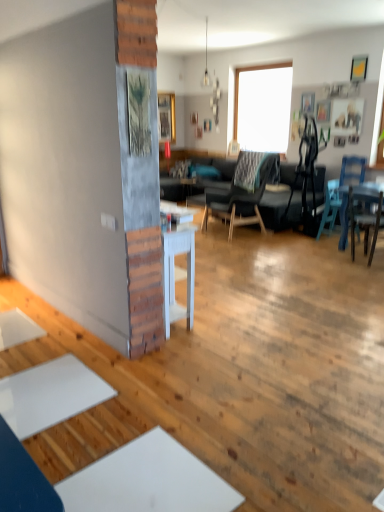
Question: In which direction should I rotate to look at wooden textured picture frame at center, marked as the first picture frame in a bottom-to-top arrangement?

Choices:
 (A) left
 (B) right

Answer: (A)

Question: Can you confirm if dark gray fabric chair at center, which is counted as the third chair, starting from the right, is bigger than blue plastic chair at right, the second chair from the right?

Choices:
 (A) no
 (B) yes

Answer: (B)

Question: From a real-world perspective, is dark gray fabric chair at center, which is counted as the third chair, starting from the right, physically above blue plastic chair at right, the second chair from the right?

Choices:
 (A) yes
 (B) no

Answer: (A)

Question: Does dark gray fabric chair at center, marked as the first chair in a left-to-right arrangement, have a greater height compared to blue plastic chair at right, the 2th chair from the left?

Choices:
 (A) yes
 (B) no

Answer: (A)

Question: Is dark gray fabric chair at center, which is counted as the third chair, starting from the right, not near blue plastic chair at right, the 2th chair from the left?

Choices:
 (A) yes
 (B) no

Answer: (A)

Question: Considering the relative sizes of dark gray fabric chair at center, marked as the first chair in a left-to-right arrangement, and blue plastic chair at right, the 2th chair from the left, in the image provided, is dark gray fabric chair at center, marked as the first chair in a left-to-right arrangement, thinner than blue plastic chair at right, the 2th chair from the left,?

Choices:
 (A) no
 (B) yes

Answer: (A)

Question: Does dark gray fabric chair at center, which is counted as the third chair, starting from the right, come in front of blue plastic chair at right, the 2th chair from the left?

Choices:
 (A) no
 (B) yes

Answer: (A)

Question: Could you tell me if blue plastic chair at right, the 2th chair from the left, is turned towards wooden picture frame at upper right, which ranks as the third picture frame in front-to-back order?

Choices:
 (A) no
 (B) yes

Answer: (A)

Question: From the image's perspective, is blue plastic chair at right, the 2th chair from the left, located above wooden picture frame at upper right, the fifth picture frame positioned from the top?

Choices:
 (A) no
 (B) yes

Answer: (A)

Question: Does blue plastic chair at right, the second chair from the right, have a greater height compared to wooden picture frame at upper right, which appears as the 2th picture frame when ordered from the bottom?

Choices:
 (A) no
 (B) yes

Answer: (B)

Question: Considering the relative positions of blue plastic chair at right, the second chair from the right, and wooden picture frame at upper right, placed as the fourth picture frame when sorted from back to front, in the image provided, is blue plastic chair at right, the second chair from the right, in front of wooden picture frame at upper right, placed as the fourth picture frame when sorted from back to front,?

Choices:
 (A) yes
 (B) no

Answer: (A)

Question: Is blue plastic chair at right, the second chair from the right, not near wooden picture frame at upper right, the second picture frame positioned from the right?

Choices:
 (A) yes
 (B) no

Answer: (B)

Question: Can you confirm if blue plastic chair at right, the second chair from the right, is thinner than wooden picture frame at upper right, the fifth picture frame from the left?

Choices:
 (A) no
 (B) yes

Answer: (A)

Question: Considering the relative sizes of wooden picture frame at upper right, the second picture frame positioned from the right, and wooden picture frame at upper right, which is the fifth picture frame in bottom-to-top order, in the image provided, is wooden picture frame at upper right, the second picture frame positioned from the right, shorter than wooden picture frame at upper right, which is the fifth picture frame in bottom-to-top order,?

Choices:
 (A) yes
 (B) no

Answer: (B)